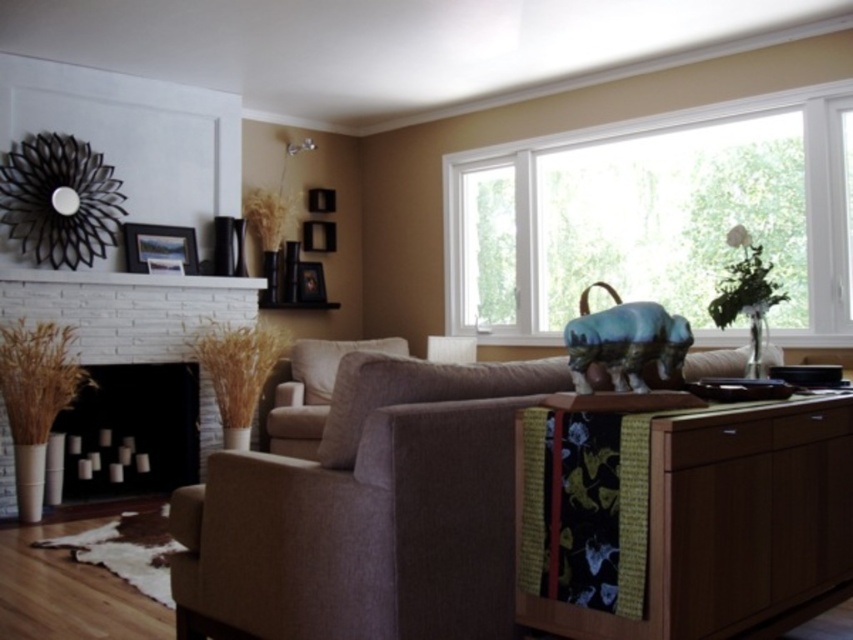
Question: Among these points, which one is nearest to the camera?

Choices:
 (A) (123, 364)
 (B) (61, 301)
 (C) (728, 186)

Answer: (B)

Question: Is white brick fireplace at left further to camera compared to metallic black picture frame at upper center?

Choices:
 (A) no
 (B) yes

Answer: (A)

Question: Is the position of wooden picture frame at upper left less distant than that of wooden picture frame at upper center?

Choices:
 (A) no
 (B) yes

Answer: (B)

Question: Is wooden cabinet at right further to camera compared to metallic black picture frame at upper center?

Choices:
 (A) yes
 (B) no

Answer: (B)

Question: Which point is closer to the camera?

Choices:
 (A) (309, 202)
 (B) (67, 481)
 (C) (305, 250)
 (D) (328, 541)

Answer: (D)

Question: Which of the following is the farthest from the observer?

Choices:
 (A) (701, 634)
 (B) (148, 224)
 (C) (323, 300)
 (D) (314, 202)

Answer: (D)